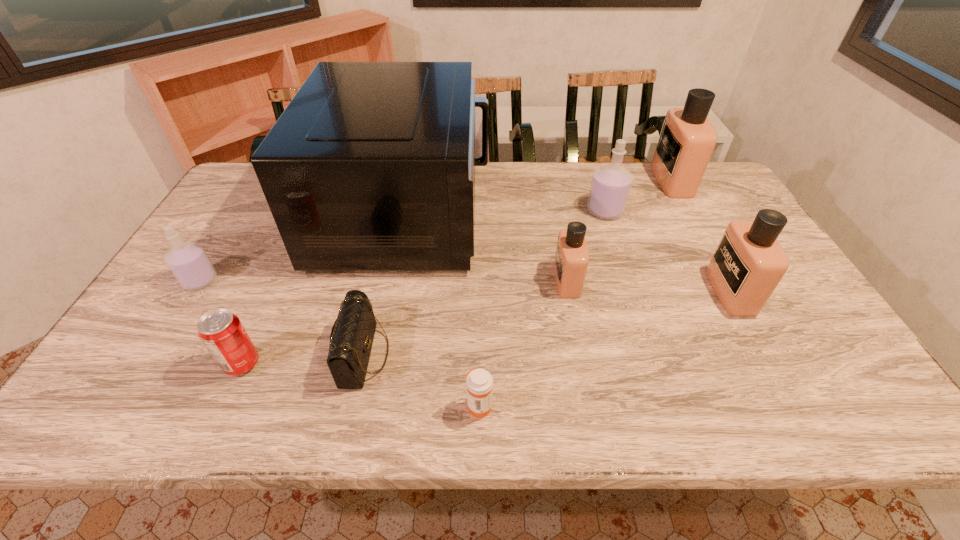
Find the location of a particular element. The width and height of the screenshot is (960, 540). the third shortest object is located at coordinates (222, 333).

This screenshot has width=960, height=540. I want to click on the second object from left to right, so click(222, 333).

This screenshot has width=960, height=540. Identify the location of clutch bag. (351, 339).

Find the location of a particular element. This screenshot has width=960, height=540. medicine is located at coordinates (479, 382).

I want to click on the nearest object, so click(x=479, y=382).

Identify the location of free space located on the front-facing side of the microwave_oven. (577, 213).

Where is `vacant space located on the front label of the tallest perfume`? This screenshot has width=960, height=540. vacant space located on the front label of the tallest perfume is located at coordinates (542, 180).

Where is `free space located 0.240m on the front label of the tallest perfume`? This screenshot has height=540, width=960. free space located 0.240m on the front label of the tallest perfume is located at coordinates (586, 180).

Locate an element on the screen. free space located on the front label of the tallest perfume is located at coordinates (615, 180).

Identify the location of blank area located 0.240m on the left of the third object from right to left. This screenshot has height=540, width=960. (510, 211).